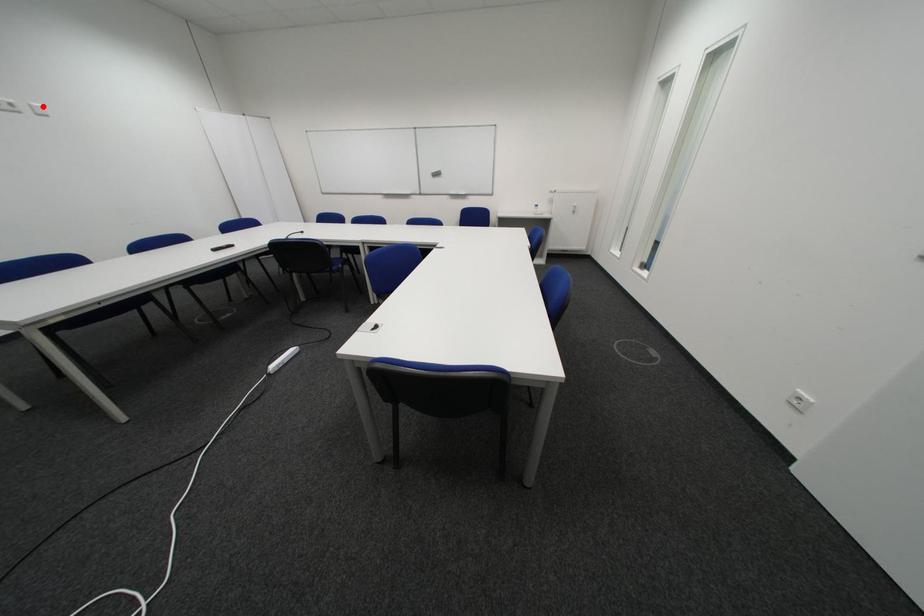
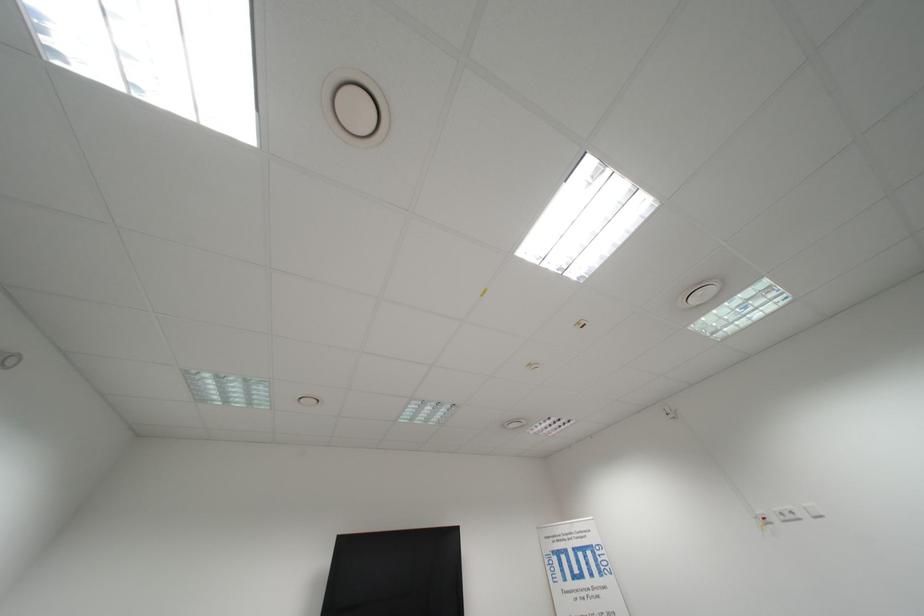
Question: A red point is marked in image1. In image2, is the corresponding 3D point closer to the camera or farther? Reply with the corresponding letter.

Choices:
 (A) The corresponding 3D point is closer.
 (B) The corresponding 3D point is farther.

Answer: (A)